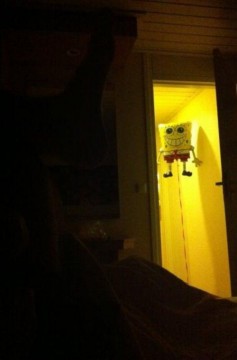
Locate an element on the screen. The width and height of the screenshot is (237, 360). bottom corner of tv is located at coordinates (117, 217).